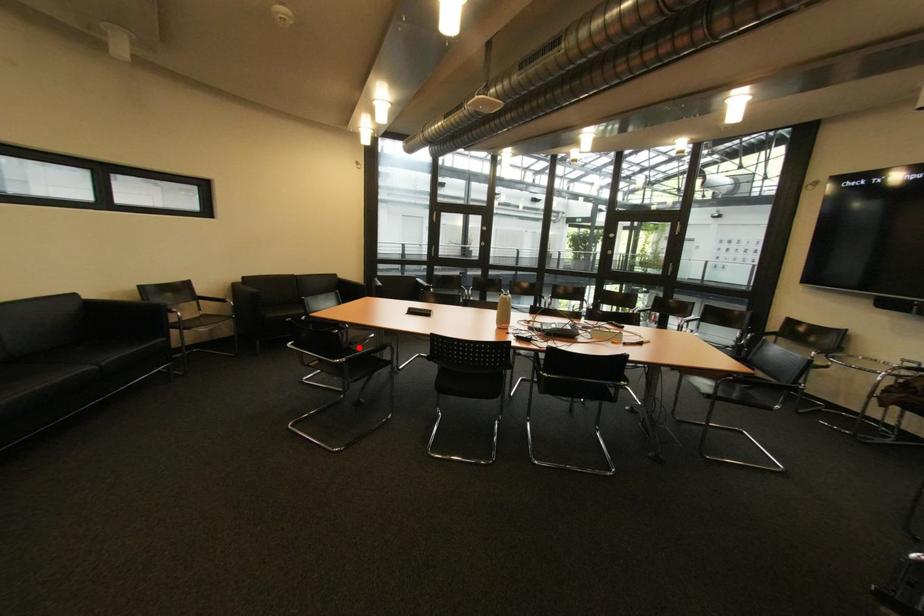
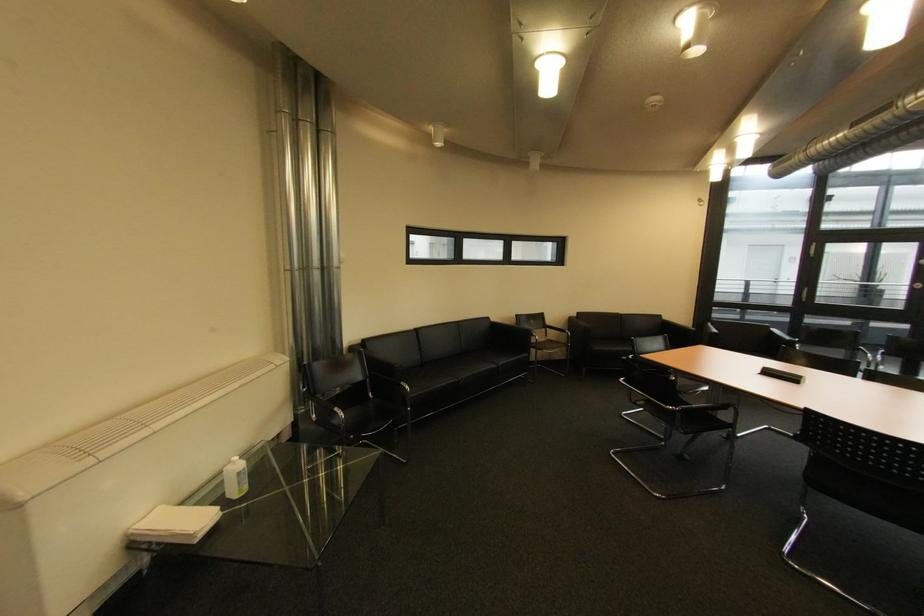
Where in the second image is the point corresponding to the highlighted location from the first image?

(687, 395)